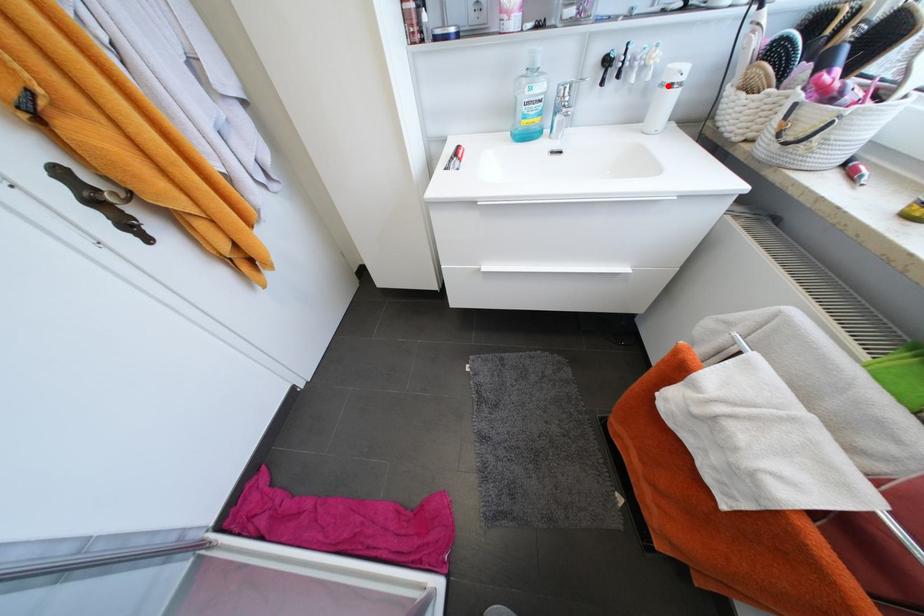
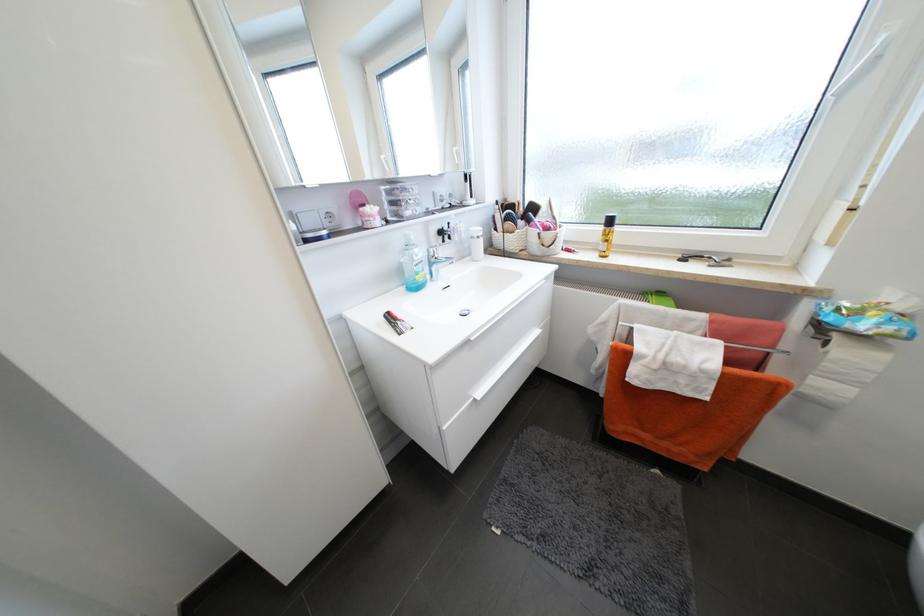
In the second image, find the point that corresponds to the highlighted location in the first image.

(478, 238)